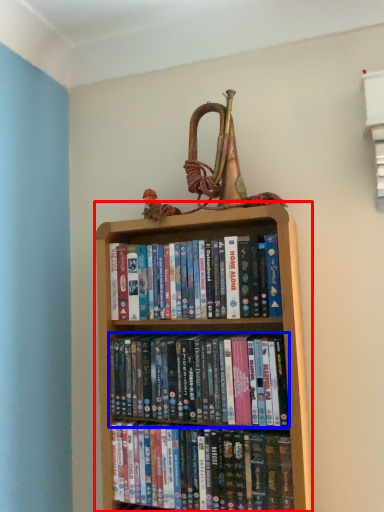
Question: Which object is further to the camera taking this photo, bookcase (highlighted by a red box) or book (highlighted by a blue box)?

Choices:
 (A) bookcase
 (B) book

Answer: (B)